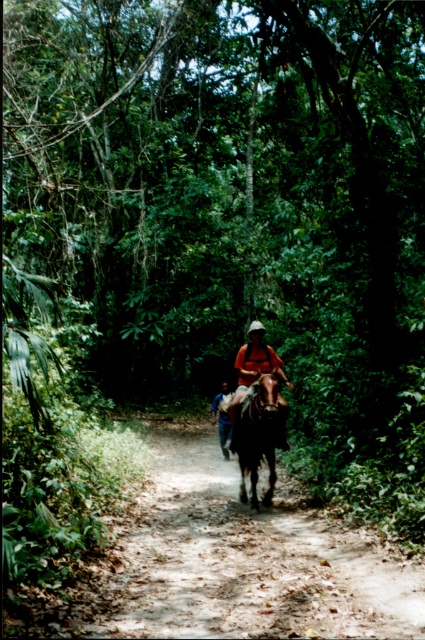
Is dirt path at center to the right of blue cotton shirt at center from the viewer's perspective?

Yes, dirt path at center is to the right of blue cotton shirt at center.

Who is more forward, [220,502] or [218,396]?

Point [220,502] is more forward.

Locate an element on the screen. The height and width of the screenshot is (640, 425). dirt path at center is located at coordinates (243, 561).

Consider the image. Which is above, dirt path at center or orange fabric shirt at center?

orange fabric shirt at center is above.

Between point (183, 618) and point (249, 364), which one is positioned behind?

Point (249, 364)

Locate an element on the screen. The width and height of the screenshot is (425, 640). dirt path at center is located at coordinates (243, 561).

Is orange fabric shirt at center below blue cotton shirt at center?

No, orange fabric shirt at center is not below blue cotton shirt at center.

In the scene shown: Who is lower down, orange fabric shirt at center or blue cotton shirt at center?

Positioned lower is blue cotton shirt at center.

In order to click on orange fabric shirt at center in this screenshot , I will do `click(252, 372)`.

The image size is (425, 640). Find the location of `orange fabric shirt at center`. orange fabric shirt at center is located at coordinates (252, 372).